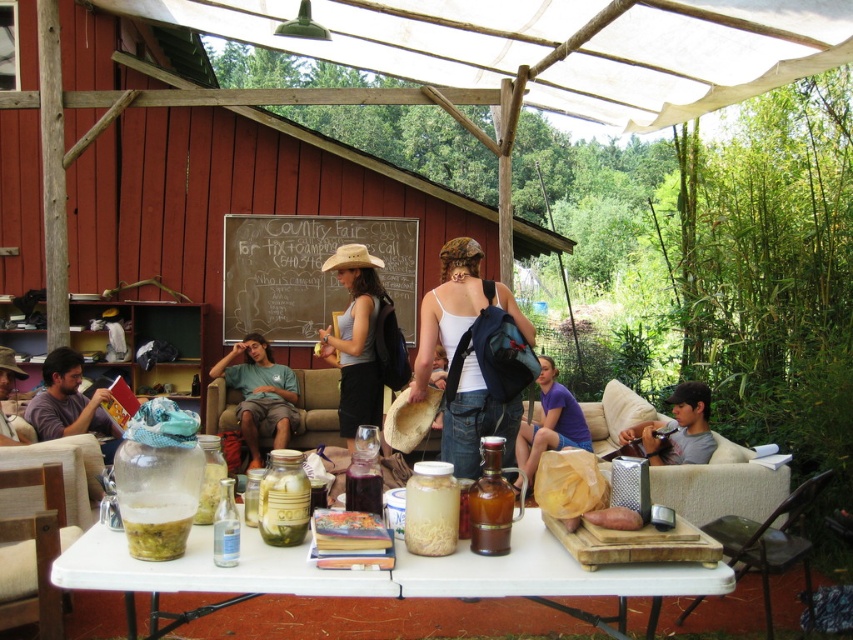
Question: Can you confirm if white fabric tank top at center is thinner than smooth brown sweet potato at center?

Choices:
 (A) no
 (B) yes

Answer: (A)

Question: Does painted wooden board at center have a larger size compared to smooth brown sweet potato at center?

Choices:
 (A) yes
 (B) no

Answer: (A)

Question: Which point is closer to the camera?

Choices:
 (A) tap(178, 548)
 (B) tap(595, 509)

Answer: (A)

Question: Among these points, which one is nearest to the camera?

Choices:
 (A) (412, 317)
 (B) (351, 544)
 (C) (479, 426)

Answer: (B)

Question: Is purple cotton shirt at center to the right of smooth brown sweet potato at center from the viewer's perspective?

Choices:
 (A) no
 (B) yes

Answer: (B)

Question: Which point is farther to the camera?

Choices:
 (A) click(328, 518)
 (B) click(3, 380)

Answer: (B)